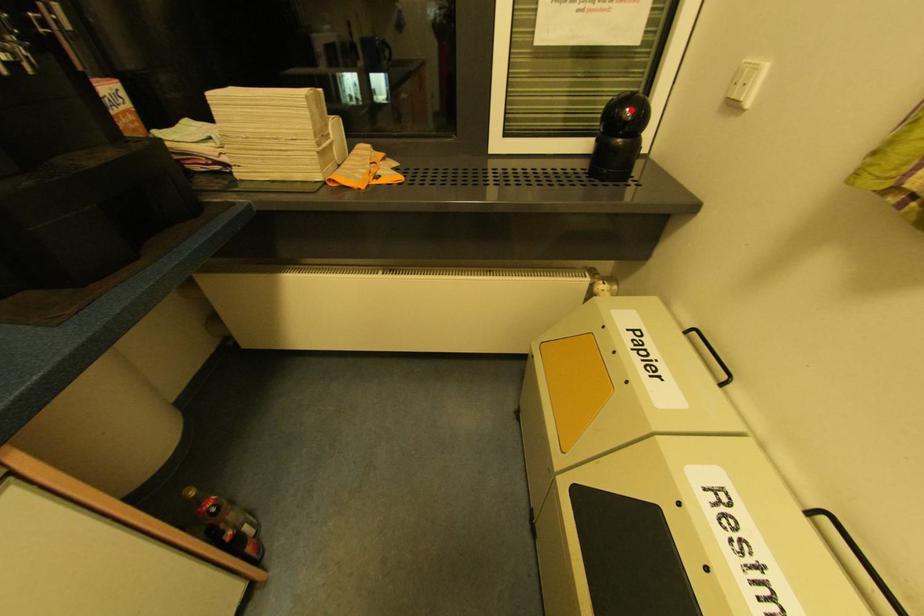
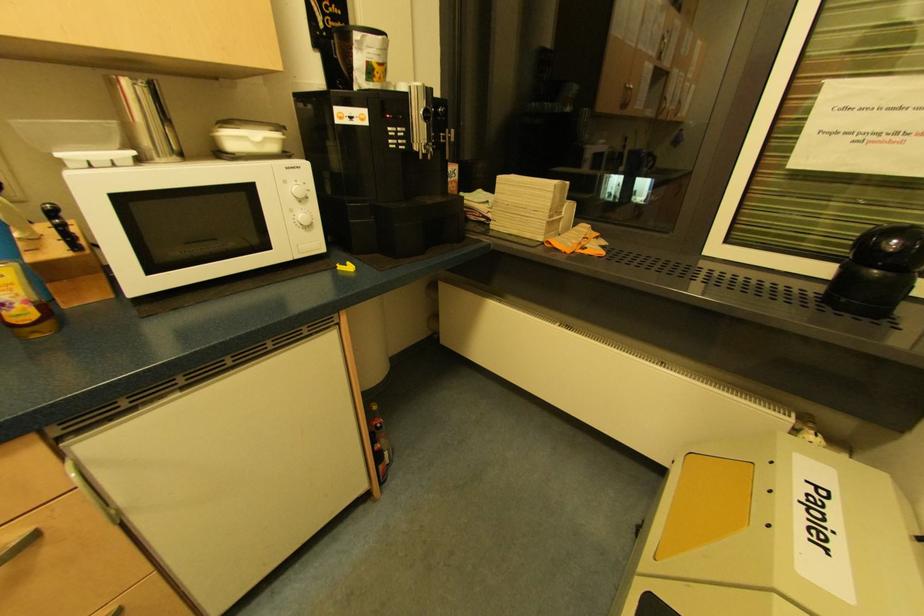
Where in the second image is the point corresponding to the highlighted location from the first image?

(897, 241)